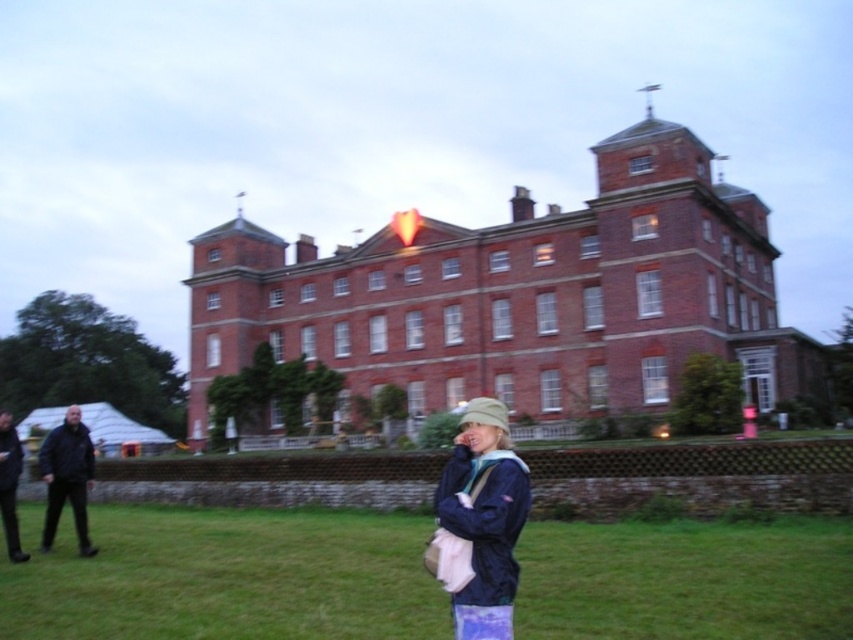
You are a photographer trying to capture the historic brick building. You notice the green grass at lower center and the black fabric jacket at left in your frame. Which object appears smaller in the photo?

The green grass at lower center appears smaller in the photo because it has a smaller size compared to the black fabric jacket at left.

You are standing at the point marked as point (480, 522) in the image. What color jacket is the person wearing at that location?

The person at point (480, 522) is wearing a navy blue jacket.